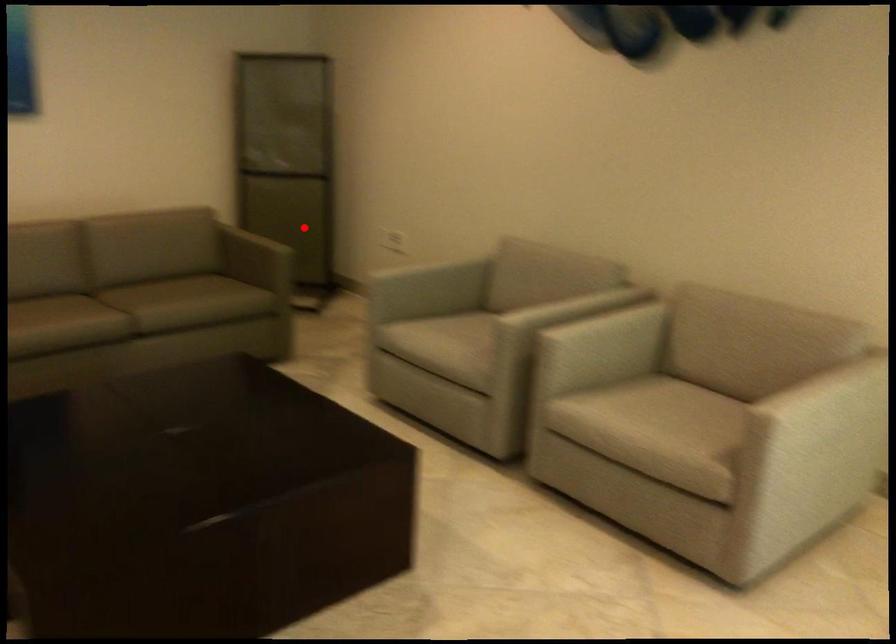
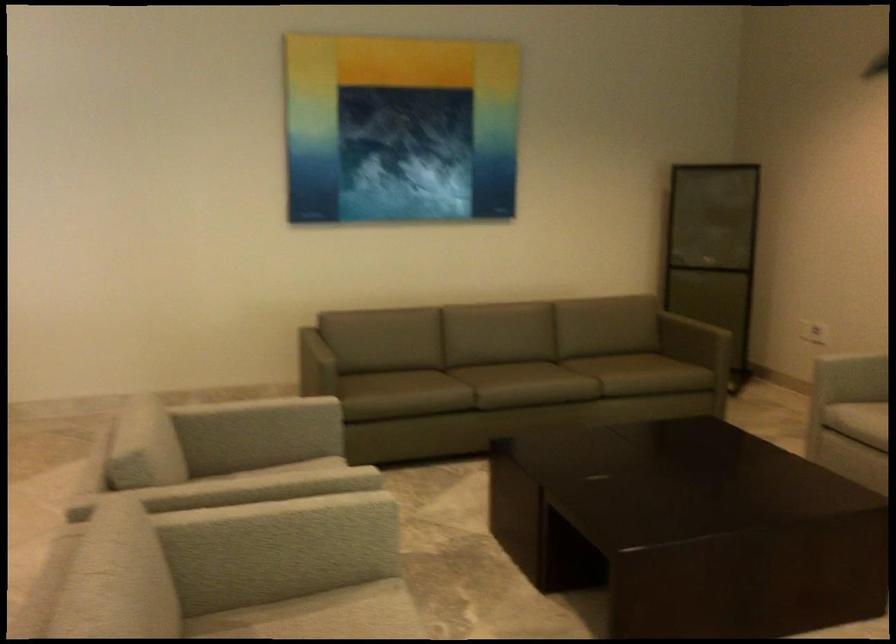
Question: I am providing you with two images of the same scene from different viewpoints. Image1 has a red point marked. In image2, the corresponding 3D location appears at what relative position? Reply with the corresponding letter.

Choices:
 (A) Closer
 (B) Farther

Answer: (B)